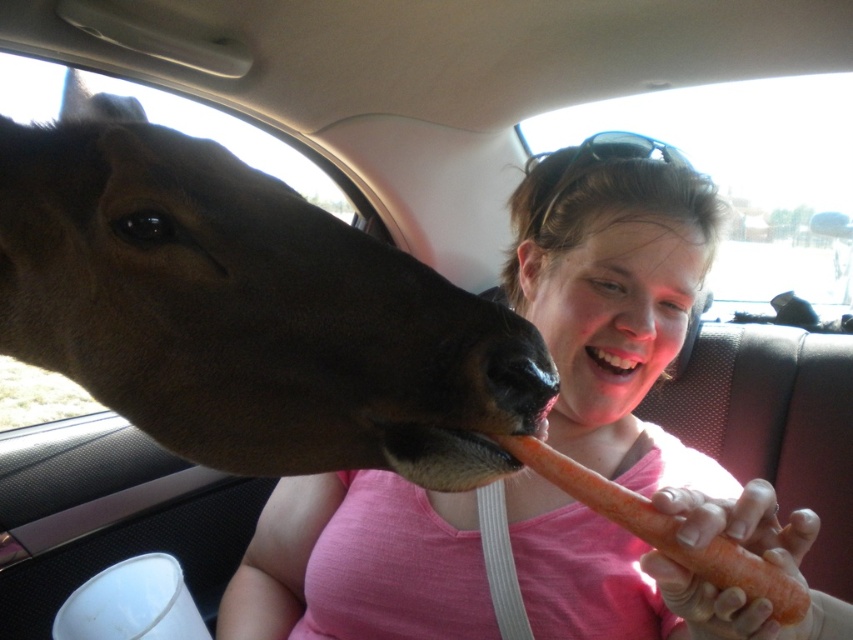
You are a passenger in a car and see the brown glossy horse head at left and the bright white teeth at mouth center. Which object is located higher in the image?

The brown glossy horse head at left is located higher than the bright white teeth at mouth center.

You are a photographer trying to capture the horse and the person in the car. You need to adjust your camera settings so that both the brown glossy horse head at left and the bright white teeth at mouth center are clearly visible. Considering their sizes, which object should you focus on first to ensure proper exposure?

The brown glossy horse head at left is larger in size than the bright white teeth at mouth center. Therefore, you should focus on the brown glossy horse head at left first to ensure proper exposure since it occupies more of the frame and its size will require more precise adjustments.

Based on the photo, you are the driver of the car and you want to place a small sticker on the transparent glass car window at upper center. The sticker must be placed exactly at the point with coordinates point (750, 179). Can you confirm if this point is on the transparent glass car window at upper center?

Yes, the point (750, 179) is on the transparent glass car window at upper center.